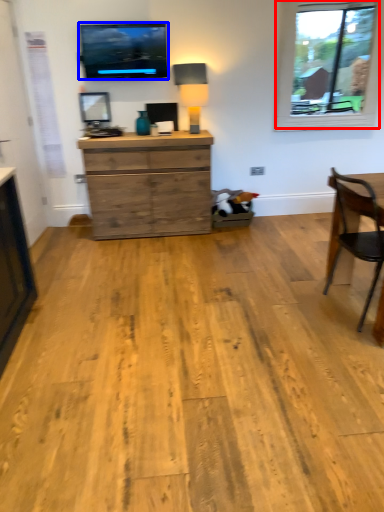
Question: Among these objects, which one is nearest to the camera, window (highlighted by a red box) or television (highlighted by a blue box)?

Choices:
 (A) window
 (B) television

Answer: (B)